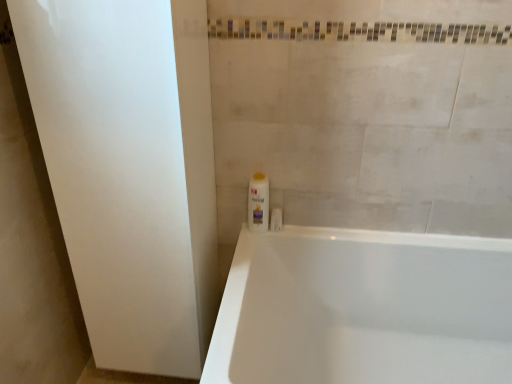
Question: Considering the relative sizes of white glossy bathtub at lower right and white plastic bottle at center in the image provided, is white glossy bathtub at lower right smaller than white plastic bottle at center?

Choices:
 (A) no
 (B) yes

Answer: (A)

Question: Are white glossy bathtub at lower right and white plastic bottle at center far apart?

Choices:
 (A) yes
 (B) no

Answer: (B)

Question: Could you tell me if white glossy bathtub at lower right is turned towards white plastic bottle at center?

Choices:
 (A) yes
 (B) no

Answer: (B)

Question: Is white glossy bathtub at lower right facing away from white plastic bottle at center?

Choices:
 (A) no
 (B) yes

Answer: (B)

Question: Considering the relative positions of white glossy bathtub at lower right and white plastic bottle at center in the image provided, is white glossy bathtub at lower right behind white plastic bottle at center?

Choices:
 (A) no
 (B) yes

Answer: (A)

Question: Would you say white glossy bathtub at lower right contains white plastic bottle at center?

Choices:
 (A) yes
 (B) no

Answer: (A)

Question: From the image's perspective, is white matte screen door at left located beneath white plastic bottle at center?

Choices:
 (A) no
 (B) yes

Answer: (B)

Question: Is white matte screen door at left behind white plastic bottle at center?

Choices:
 (A) yes
 (B) no

Answer: (B)

Question: Is white plastic bottle at center located within white matte screen door at left?

Choices:
 (A) no
 (B) yes

Answer: (A)

Question: Is white matte screen door at left directly adjacent to white plastic bottle at center?

Choices:
 (A) no
 (B) yes

Answer: (A)

Question: Would you consider white matte screen door at left to be distant from white plastic bottle at center?

Choices:
 (A) no
 (B) yes

Answer: (A)

Question: Considering the relative positions of white matte screen door at left and white plastic bottle at center in the image provided, is white matte screen door at left to the right of white plastic bottle at center from the viewer's perspective?

Choices:
 (A) yes
 (B) no

Answer: (B)

Question: Is white matte screen door at left to the right of white glossy bathtub at lower right from the viewer's perspective?

Choices:
 (A) no
 (B) yes

Answer: (A)